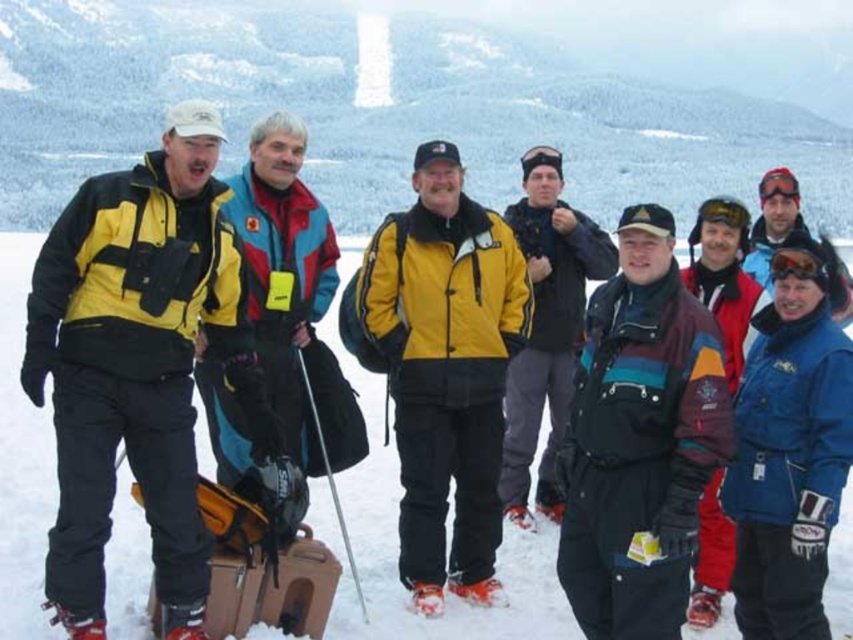
In the snowy mountain landscape scene, there are two jackets at the center of the image. The jackets are labeled as multicolored fleece jacket at center and yellow matte jacket at center. Which jacket is positioned lower in the image?

The multicolored fleece jacket at center is located below the yellow matte jacket at center, so it is positioned lower in the image.

You are a photographer trying to capture the group of eight individuals standing in the snowy landscape. To ensure the white fluffy snow at center is in the background, where should you position yourself relative to the group?

The white fluffy snow at center is located at point (396, 540), so you should position yourself behind the group facing away from the snow to have it in the background.

You are a photographer standing in front of the group of eight individuals in the snowy landscape. You want to take a photo that includes both the point at coordinates point (401, 284) and point (511, 394). Which point should you focus on first to ensure both are in focus?

You should focus on point (401, 284) first because it is closer to the viewer than point (511, 394), ensuring the depth of field captures both points effectively.